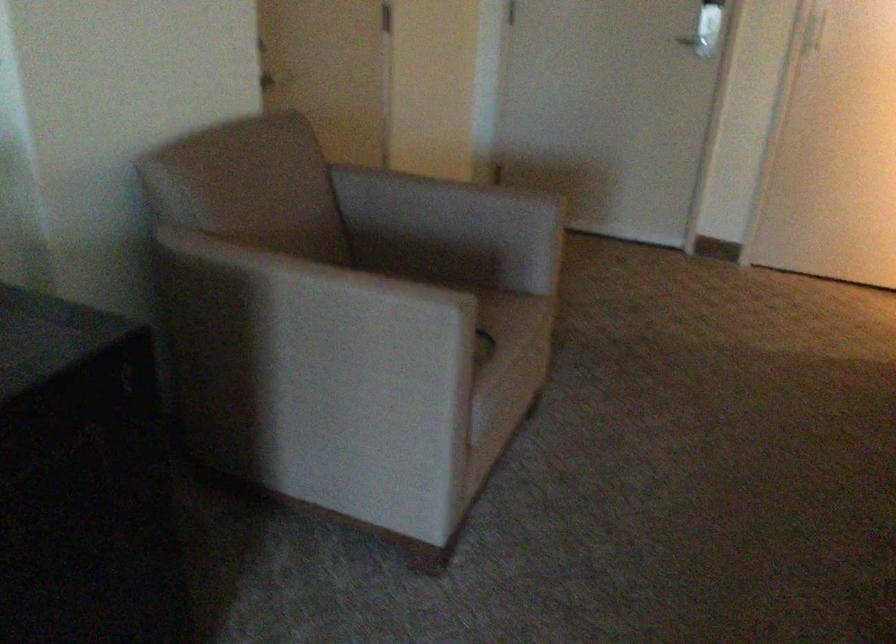
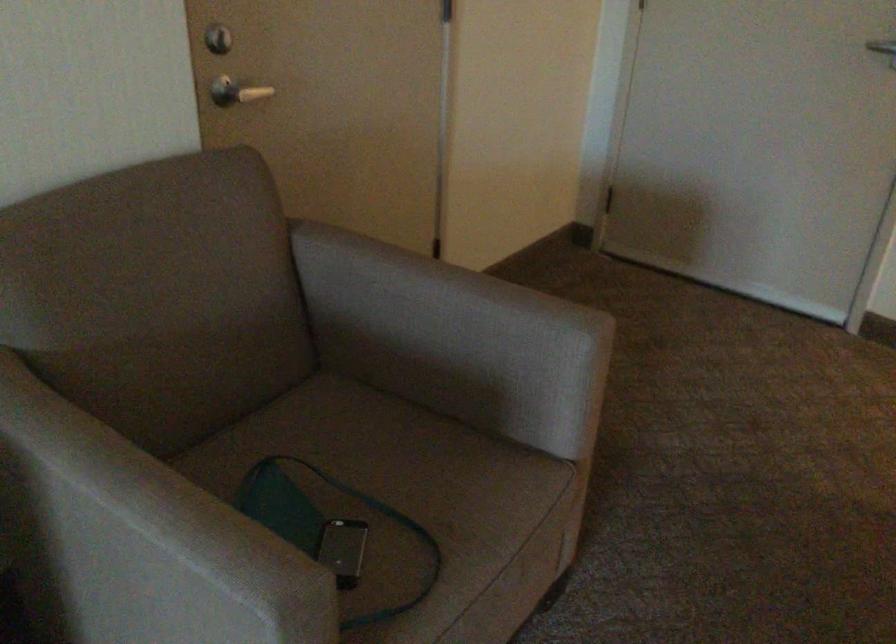
The point at (461, 223) is marked in the first image. Where is the corresponding point in the second image?

(453, 339)